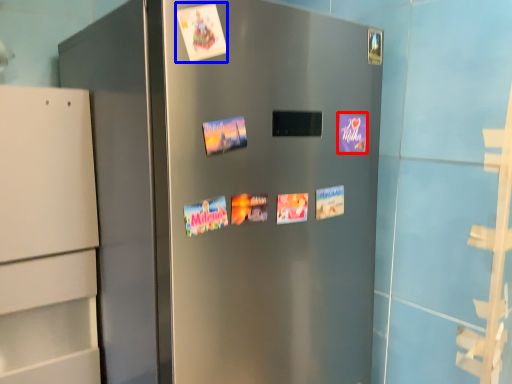
Question: Which of the following is the closest to the observer, postcard (highlighted by a red box) or flyer (highlighted by a blue box)?

Choices:
 (A) postcard
 (B) flyer

Answer: (B)